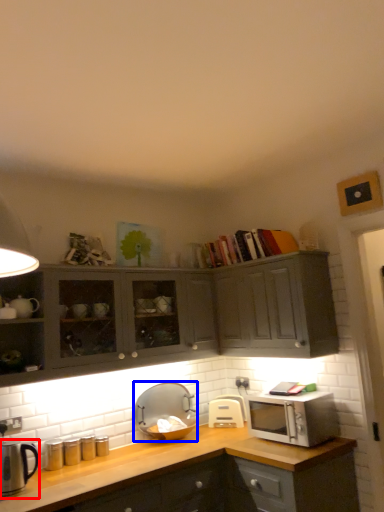
Question: Which object is closer to the camera taking this photo, appliance (highlighted by a red box) or appliance (highlighted by a blue box)?

Choices:
 (A) appliance
 (B) appliance

Answer: (A)